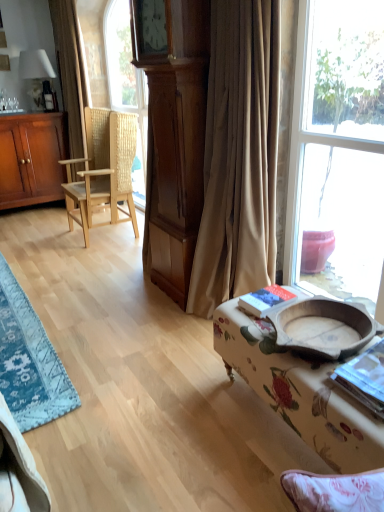
Question: Is floral fabric ottoman at lower right inside or outside of brown textured curtain at left, which ranks as the 1th curtain in back-to-front order?

Choices:
 (A) inside
 (B) outside

Answer: (B)

Question: From their relative heights in the image, would you say floral fabric ottoman at lower right is taller or shorter than brown textured curtain at left, which ranks as the 1th curtain in back-to-front order?

Choices:
 (A) tall
 (B) short

Answer: (B)

Question: Estimate the real-world distances between objects in this image. Which object is farther from the floral fabric ottoman at lower right?

Choices:
 (A) matte brown cabinet at left
 (B) beige fabric curtain at center, placed as the second curtain when sorted from back to front
 (C) brown textured curtain at left, which is the 2th curtain in front-to-back order
 (D) blue woven rug at lower left
 (E) natural wood woven chair at left

Answer: (A)

Question: Estimate the real-world distances between objects in this image. Which object is closer to the matte brown cabinet at left?

Choices:
 (A) beige fabric curtain at center, acting as the first curtain starting from the front
 (B) brown textured curtain at left, which is the 2th curtain in front-to-back order
 (C) floral fabric ottoman at lower right
 (D) blue woven rug at lower left
 (E) natural wood woven chair at left

Answer: (B)